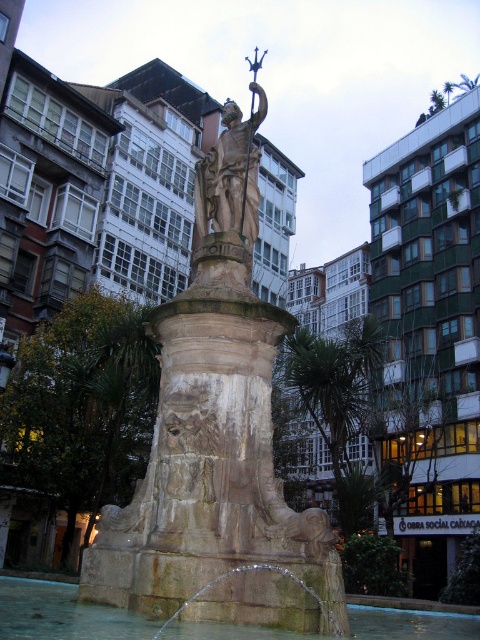
Does clear water at fountain center appear over green leafy palm tree at center?

Actually, clear water at fountain center is below green leafy palm tree at center.

Locate an element on the screen. This screenshot has width=480, height=640. clear water at fountain center is located at coordinates (62, 612).

Does stone fountain at center lie behind green leafy palm tree at center?

No, it is in front of green leafy palm tree at center.

Which is behind, point (124, 596) or point (346, 369)?

The point (346, 369) is behind.

Describe the element at coordinates (217, 444) in the screenshot. I see `stone fountain at center` at that location.

This screenshot has height=640, width=480. Identify the location of stone fountain at center. pyautogui.click(x=217, y=444).

Is stone fountain at center below clear water at fountain center?

Actually, stone fountain at center is above clear water at fountain center.

Is point (195, 490) farther from camera compared to point (24, 628)?

Yes, point (195, 490) is farther from viewer.

This screenshot has height=640, width=480. In order to click on stone fountain at center in this screenshot , I will do `click(217, 444)`.